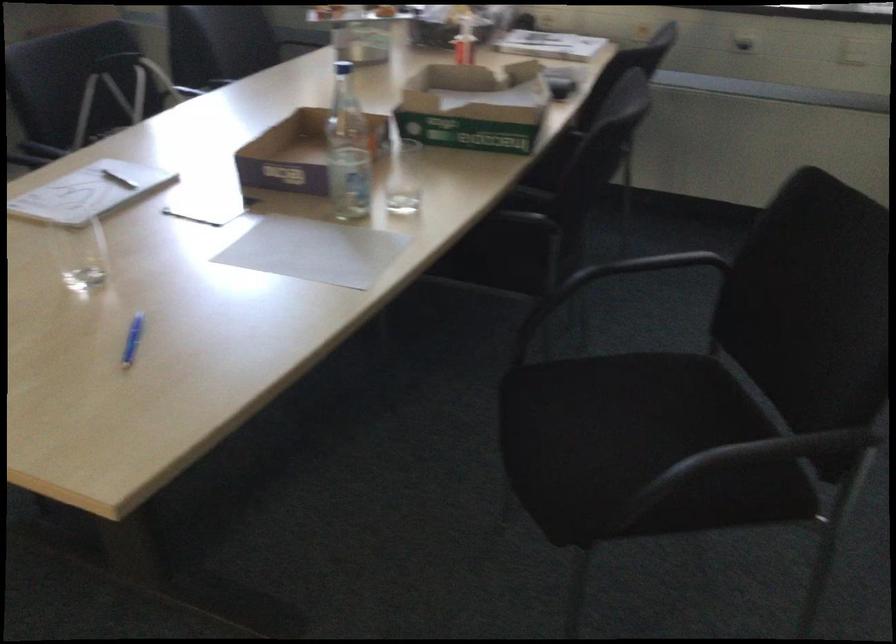
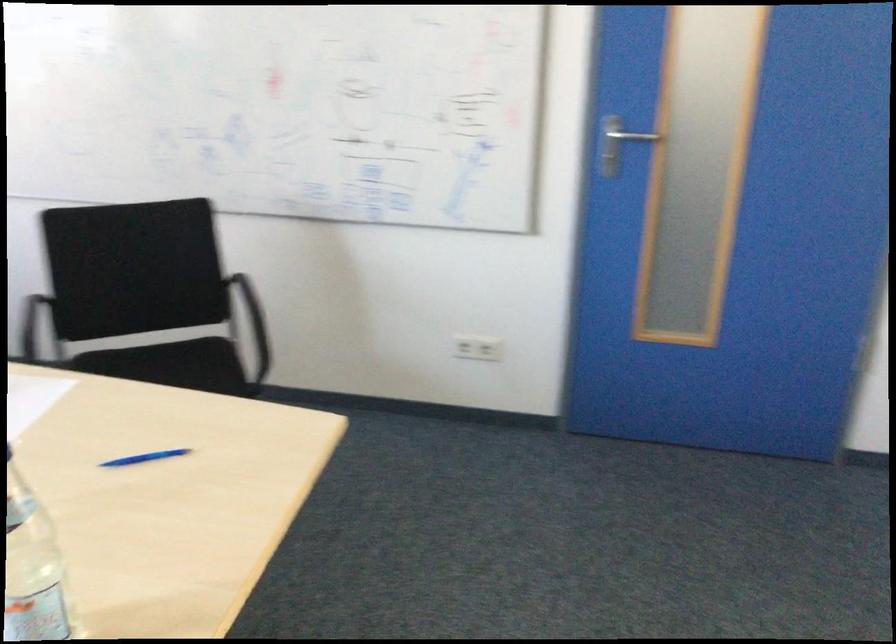
Where in the second image is the point corresponding to (x=648, y=462) from the first image?

(194, 364)